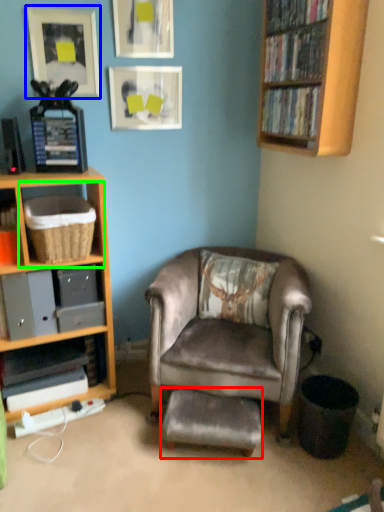
Question: Estimate the real-world distances between objects in this image. Which object is farther from footrest (highlighted by a red box), picture frame (highlighted by a blue box) or shelf (highlighted by a green box)?

Choices:
 (A) picture frame
 (B) shelf

Answer: (A)